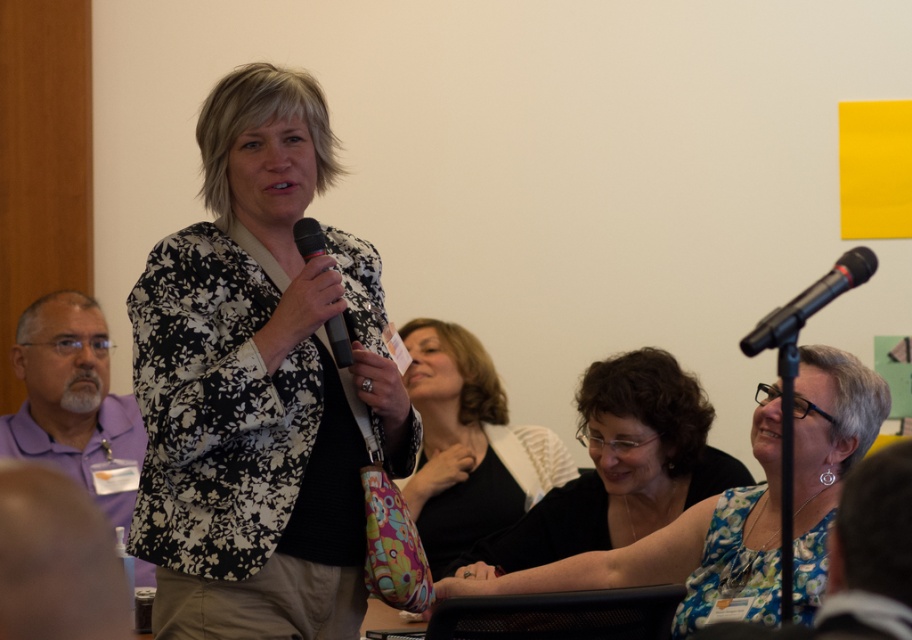
Question: Estimate the real-world distances between objects in this image. Which object is farther from the floral fabric blouse at center?

Choices:
 (A) black matte microphone at center
 (B) black metallic microphone at upper right
 (C) floral-patterned blazer at center

Answer: (B)

Question: Can you confirm if purple fabric shirt at left is positioned above black matte microphone at center?

Choices:
 (A) yes
 (B) no

Answer: (B)

Question: Is floral-patterned blazer at center closer to the viewer compared to black metallic microphone at upper right?

Choices:
 (A) yes
 (B) no

Answer: (B)

Question: Which point appears closest to the camera in this image?

Choices:
 (A) (771, 321)
 (B) (271, 150)

Answer: (A)

Question: Among these points, which one is farthest from the camera?

Choices:
 (A) (73, 435)
 (B) (562, 500)
 (C) (342, 316)

Answer: (A)

Question: Where is floral-patterned blazer at center located in relation to floral fabric blouse at center in the image?

Choices:
 (A) right
 (B) left

Answer: (B)